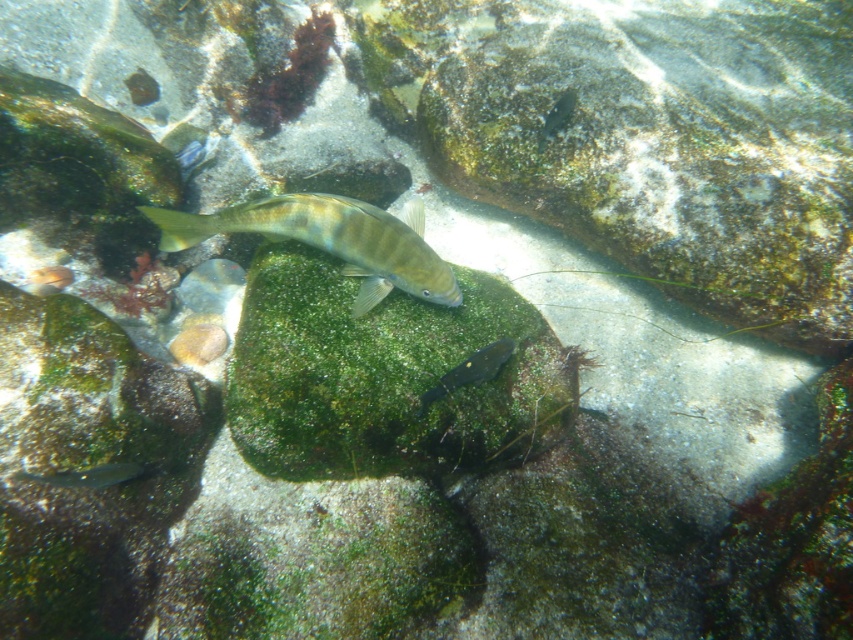
At what (x,y) coordinates should I click in order to perform the action: click on greenish-yellow translucent fish at center. Please return your answer as a coordinate pair (x, y). Looking at the image, I should click on coord(331,240).

Between greenish-yellow translucent fish at center and shiny silver fish at lower left, which one has more height?

greenish-yellow translucent fish at center

Is point (393, 221) positioned behind point (106, 476)?

Yes, point (393, 221) is farther from viewer.

Locate an element on the screen. greenish-yellow translucent fish at center is located at coordinates (331, 240).

Can you confirm if shiny silver fish at center is positioned to the left of shiny silver fish at lower left?

No, shiny silver fish at center is not to the left of shiny silver fish at lower left.

Which is behind, point (485, 374) or point (97, 465)?

Point (485, 374)

I want to click on shiny silver fish at center, so click(x=469, y=371).

Between point (344, 243) and point (448, 374), which one is positioned behind?

The point (344, 243) is more distant.

Is the position of greenish-yellow translucent fish at center less distant than that of shiny silver fish at center?

No, it is not.

Which is in front, point (413, 225) or point (451, 381)?

Point (451, 381) is in front.

This screenshot has height=640, width=853. I want to click on greenish-yellow translucent fish at center, so click(x=331, y=240).